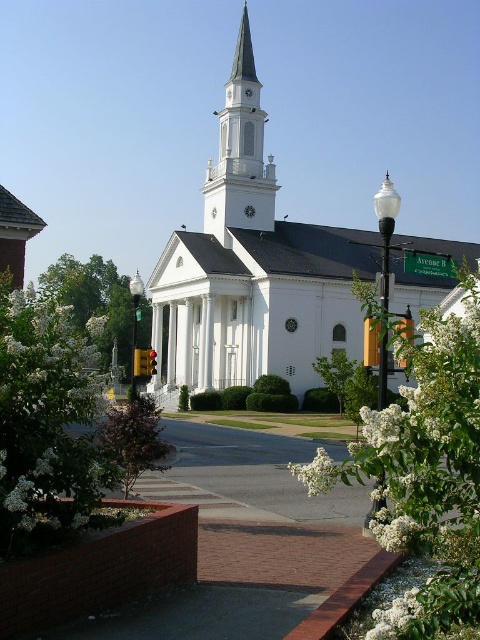
Question: Based on their relative distances, which object is farther from the green leafy tree at center?

Choices:
 (A) white steeple at center
 (B) white fluffy flowers at center
 (C) white fluffy flower at lower center

Answer: (B)

Question: Which point appears closest to the camera in this image?

Choices:
 (A) (12, 340)
 (B) (84, 310)

Answer: (A)

Question: Does white fluffy flowers at lower left appear over green leafy tree at left?

Choices:
 (A) no
 (B) yes

Answer: (A)

Question: Can you confirm if white fluffy flowers at center is bigger than brown textured tree at lower left?

Choices:
 (A) yes
 (B) no

Answer: (A)

Question: Among these objects, which one is farthest from the camera?

Choices:
 (A) white steeple at center
 (B) brown textured tree at lower left
 (C) white fluffy flower at lower center

Answer: (A)

Question: Where is white smooth church at center located in relation to green leafy tree at center in the image?

Choices:
 (A) above
 (B) below

Answer: (A)